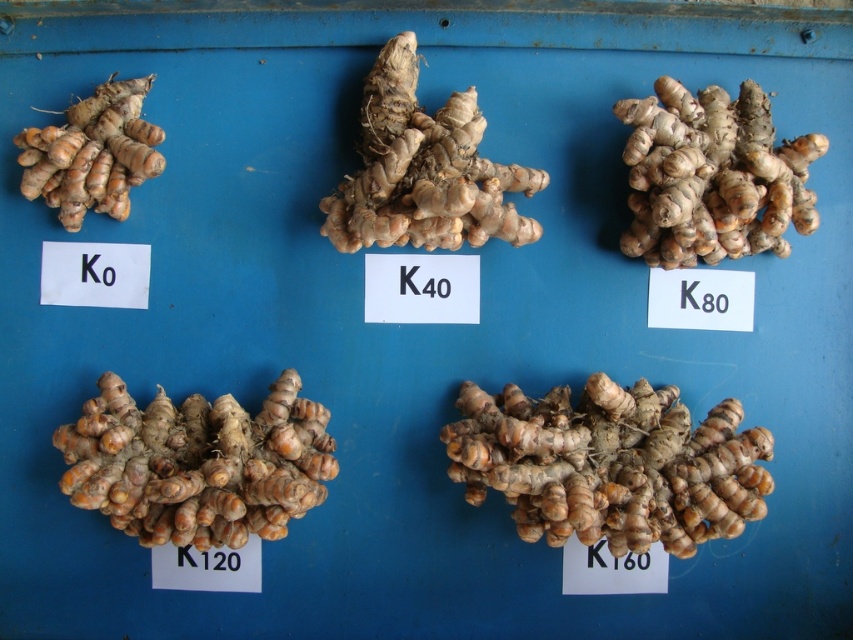
Does point (801, 192) lie in front of point (84, 163)?

Yes, point (801, 192) is in front of point (84, 163).

The width and height of the screenshot is (853, 640). What do you see at coordinates (711, 176) in the screenshot?
I see `brown rough ginger at right` at bounding box center [711, 176].

Is point (752, 179) positioned before point (125, 211)?

Yes, it is.

The width and height of the screenshot is (853, 640). Find the location of `brown rough ginger at right`. brown rough ginger at right is located at coordinates (711, 176).

Between orange-brown textured root at bottom left and brown rough ginger at center, which one appears on the left side from the viewer's perspective?

orange-brown textured root at bottom left

Between orange-brown textured root at bottom left and brown rough ginger at center, which one has less height?

With less height is orange-brown textured root at bottom left.

Is point (135, 452) behind point (515, 244)?

No, (135, 452) is in front of (515, 244).

Locate an element on the screen. Image resolution: width=853 pixels, height=640 pixels. orange-brown textured root at bottom left is located at coordinates (196, 464).

Is orange-brown textured root at bottom left bigger than brown rough ginger at right?

Yes, orange-brown textured root at bottom left is bigger than brown rough ginger at right.

Can you confirm if orange-brown textured root at bottom left is smaller than brown rough ginger at right?

Actually, orange-brown textured root at bottom left might be larger than brown rough ginger at right.

Where is `orange-brown textured root at bottom left`? orange-brown textured root at bottom left is located at coordinates (196, 464).